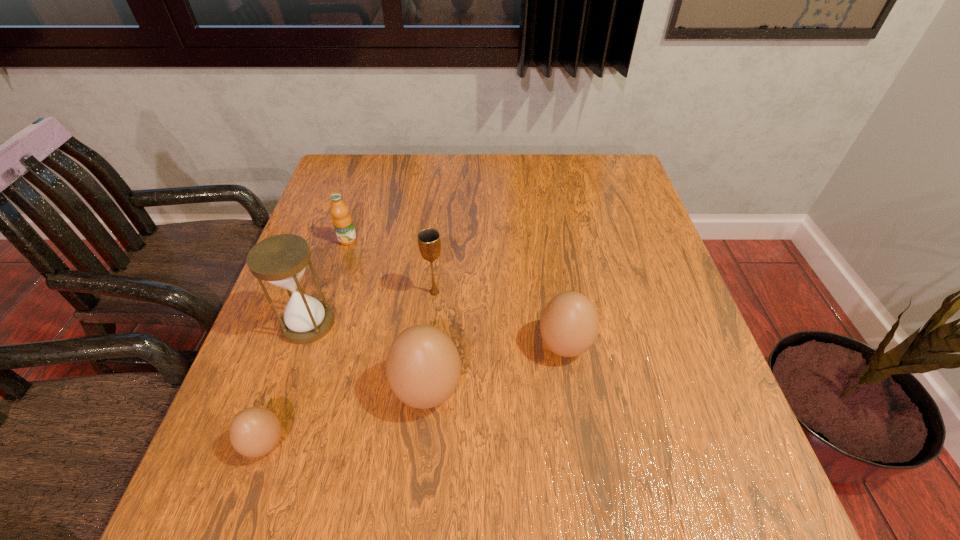
Where is `vacant space located 0.120m on the right of the second tallest boiled egg`? The height and width of the screenshot is (540, 960). vacant space located 0.120m on the right of the second tallest boiled egg is located at coordinates (649, 346).

The height and width of the screenshot is (540, 960). I want to click on vacant area located 0.070m on the label of the farthest object, so click(x=340, y=265).

This screenshot has width=960, height=540. I want to click on free space located 0.050m on the back of the chalice, so click(x=437, y=270).

Find the location of a particular element. Image resolution: width=960 pixels, height=540 pixels. vacant space located on the right of the hourglass is located at coordinates (471, 323).

This screenshot has height=540, width=960. I want to click on boiled egg that is positioned at the left edge, so click(255, 431).

Find the location of a particular element. orange juice located at the left edge is located at coordinates (342, 221).

You are a GUI agent. You are given a task and a screenshot of the screen. Output one action in this format:
    pyautogui.click(x=<x>, y=<y>)
    Task: Click on the hourglass that is at the left edge
    
    Given the screenshot: What is the action you would take?
    pyautogui.click(x=281, y=260)

Find the location of a particular element. This screenshot has width=960, height=540. object that is at the near left corner is located at coordinates (255, 431).

Where is `blank space at the far edge of the desktop`? blank space at the far edge of the desktop is located at coordinates (419, 161).

In the image, there is a desktop. What are the coordinates of `free space at the near edge` in the screenshot? It's located at (367, 437).